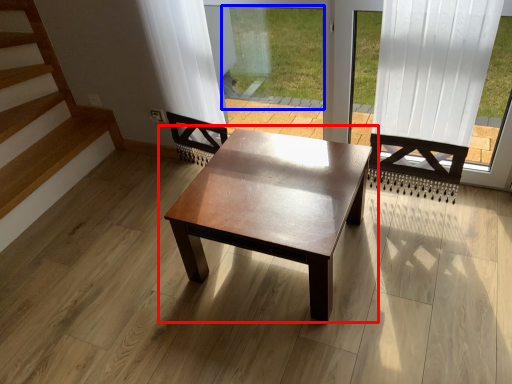
Question: Which object appears closest to the camera in this image, coffee table (highlighted by a red box) or window screen (highlighted by a blue box)?

Choices:
 (A) coffee table
 (B) window screen

Answer: (A)